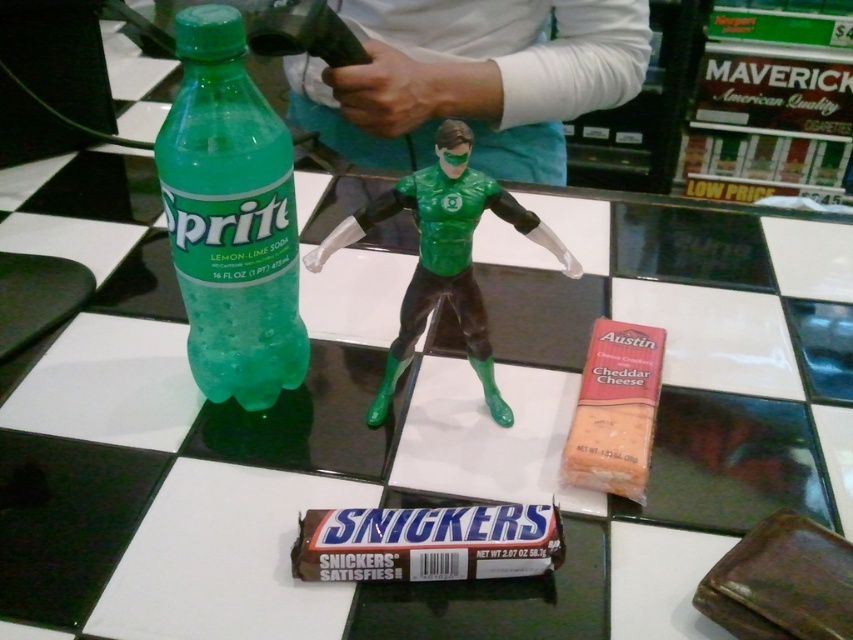
Which is more to the right, translucent green plastic bottle at left or green matte figure at center?

green matte figure at center

Which is in front, point (204, 259) or point (410, 340)?

Point (204, 259) is more forward.

Describe the element at coordinates (230, 218) in the screenshot. I see `translucent green plastic bottle at left` at that location.

This screenshot has width=853, height=640. In order to click on translucent green plastic bottle at left in this screenshot , I will do `click(230, 218)`.

Who is lower down, green matte figure at center or chocolate brown candy bar at lower center?

chocolate brown candy bar at lower center

Locate an element on the screen. green matte figure at center is located at coordinates (444, 257).

Does point (521, 227) come farther from viewer compared to point (416, 536)?

Yes.

Where is `green matte figure at center`? green matte figure at center is located at coordinates (444, 257).

Which is in front, point (323, 99) or point (334, 241)?

Point (334, 241) is more forward.

Does green plastic toy at center appear on the left side of green matte figure at center?

Incorrect, green plastic toy at center is not on the left side of green matte figure at center.

Is point (384, 129) positioned in front of point (479, 198)?

No.

This screenshot has width=853, height=640. What are the coordinates of `green plastic toy at center` in the screenshot? It's located at coord(476,80).